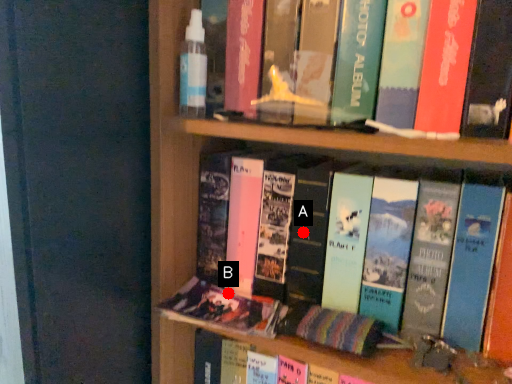
Question: Two points are circled on the image, labeled by A and B beside each circle. Which point appears closest to the camera in this image?

Choices:
 (A) A is closer
 (B) B is closer

Answer: (A)